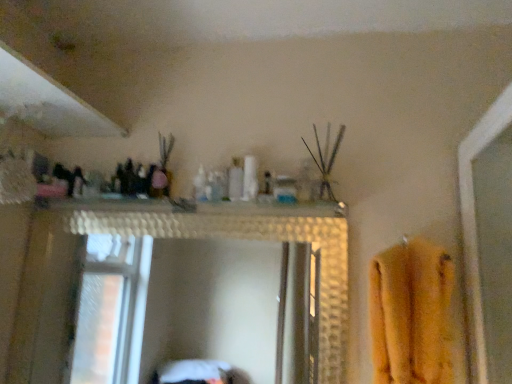
Question: From a real-world perspective, is white glossy shelf at upper center positioned under yellow fuzzy bath towel at right based on gravity?

Choices:
 (A) no
 (B) yes

Answer: (A)

Question: Does white glossy shelf at upper center have a lesser height compared to yellow fuzzy bath towel at right?

Choices:
 (A) yes
 (B) no

Answer: (A)

Question: Is white glossy shelf at upper center wider than yellow fuzzy bath towel at right?

Choices:
 (A) no
 (B) yes

Answer: (A)

Question: Is white glossy shelf at upper center at the left side of yellow fuzzy bath towel at right?

Choices:
 (A) yes
 (B) no

Answer: (A)

Question: Is white glossy shelf at upper center facing towards yellow fuzzy bath towel at right?

Choices:
 (A) no
 (B) yes

Answer: (A)

Question: Based on their sizes in the image, would you say white glossy shelf at upper center is bigger or smaller than translucent plastic bottle at center?

Choices:
 (A) big
 (B) small

Answer: (A)

Question: From their relative heights in the image, would you say white glossy shelf at upper center is taller or shorter than translucent plastic bottle at center?

Choices:
 (A) tall
 (B) short

Answer: (B)

Question: From a real-world perspective, relative to translucent plastic bottle at center, is white glossy shelf at upper center vertically above or below?

Choices:
 (A) below
 (B) above

Answer: (A)

Question: Would you say white glossy shelf at upper center is to the left or to the right of translucent plastic bottle at center in the picture?

Choices:
 (A) left
 (B) right

Answer: (A)

Question: Is yellow fuzzy bath towel at right in front of or behind white glossy shelf at upper center in the image?

Choices:
 (A) behind
 (B) front

Answer: (B)

Question: Choose the correct answer: Is yellow fuzzy bath towel at right inside white glossy shelf at upper center or outside it?

Choices:
 (A) inside
 (B) outside

Answer: (B)

Question: From the image's perspective, is yellow fuzzy bath towel at right located above or below white glossy shelf at upper center?

Choices:
 (A) above
 (B) below

Answer: (B)

Question: Is yellow fuzzy bath towel at right taller or shorter than white glossy shelf at upper center?

Choices:
 (A) short
 (B) tall

Answer: (B)

Question: Considering the positions of white glossy shelf at upper center and yellow fuzzy bath towel at right in the image, is white glossy shelf at upper center wider or thinner than yellow fuzzy bath towel at right?

Choices:
 (A) thin
 (B) wide

Answer: (A)

Question: From the image's perspective, is white glossy shelf at upper center located above or below yellow fuzzy bath towel at right?

Choices:
 (A) above
 (B) below

Answer: (A)